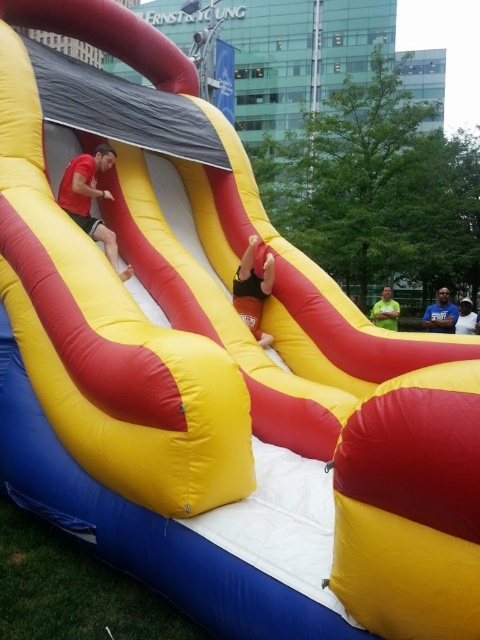
How distant is green matte shirt at lower right from white cotton shirt at center?

35.96 inches

Does point (375, 323) come farther from viewer compared to point (478, 321)?

Yes, point (375, 323) is farther from viewer.

Locate an element on the screen. green matte shirt at lower right is located at coordinates click(x=385, y=310).

The image size is (480, 640). In order to click on green matte shirt at lower right in this screenshot , I will do `click(385, 310)`.

Can you confirm if matte red t-shirt at center is taller than green matte shirt at lower right?

Yes.

Looking at this image, between matte red t-shirt at center and green matte shirt at lower right, which one is positioned lower?

green matte shirt at lower right is below.

Between point (87, 209) and point (371, 314), which one is positioned behind?

The point (371, 314) is behind.

Where is `matte red t-shirt at center`? This screenshot has width=480, height=640. matte red t-shirt at center is located at coordinates (91, 198).

Can you confirm if smooth pink foot at center is positioned to the left of green matte shirt at lower right?

Indeed, smooth pink foot at center is positioned on the left side of green matte shirt at lower right.

Identify the location of smooth pink foot at center. (252, 291).

Locate an element on the screen. smooth pink foot at center is located at coordinates (252, 291).